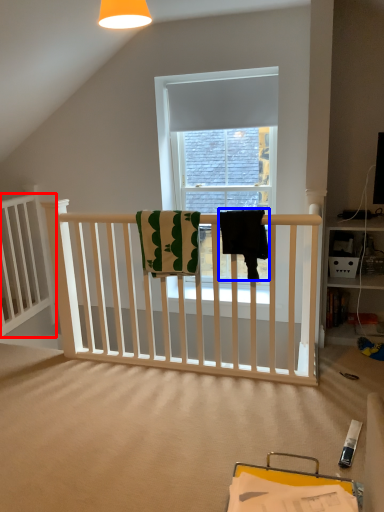
Question: Which of the following is the farthest to the observer, bed frame (highlighted by a red box) or beach towel (highlighted by a blue box)?

Choices:
 (A) bed frame
 (B) beach towel

Answer: (A)